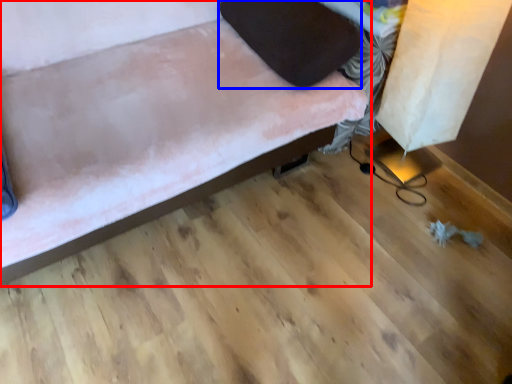
Question: Among these objects, which one is farthest to the camera, furniture (highlighted by a red box) or pillow (highlighted by a blue box)?

Choices:
 (A) furniture
 (B) pillow

Answer: (B)